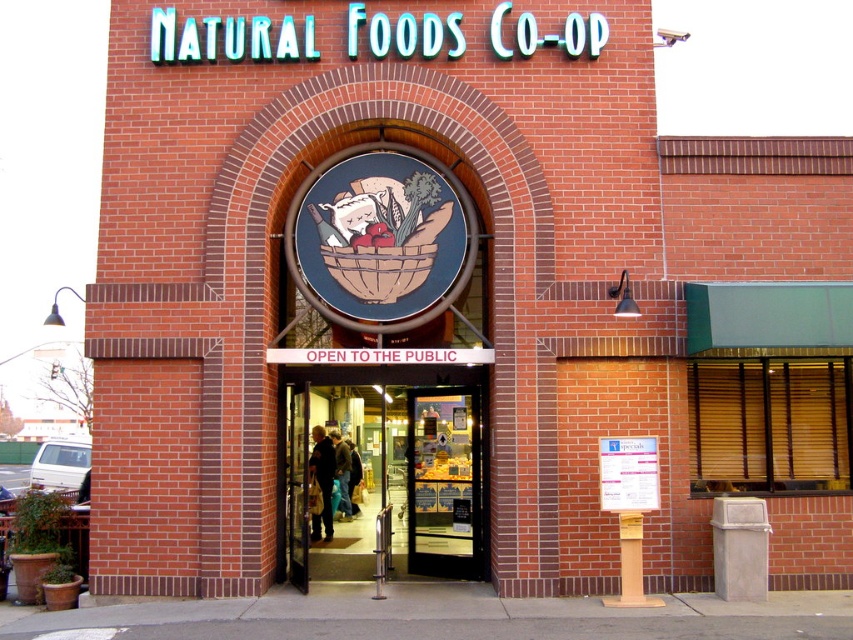
Question: Does glass door at center appear under white paper sign at center?

Choices:
 (A) yes
 (B) no

Answer: (B)

Question: Can you confirm if glass door at center is positioned to the right of white paper sign at center?

Choices:
 (A) no
 (B) yes

Answer: (A)

Question: Among these points, which one is nearest to the camera?

Choices:
 (A) (612, 512)
 (B) (447, 371)

Answer: (A)

Question: Which of the following is the farthest from the observer?

Choices:
 (A) (440, 392)
 (B) (639, 490)

Answer: (A)

Question: In this image, where is glass door at center located relative to white paper sign at center?

Choices:
 (A) right
 (B) left

Answer: (B)

Question: Which object is closer to the camera taking this photo?

Choices:
 (A) glass door at center
 (B) white paper sign at center

Answer: (B)